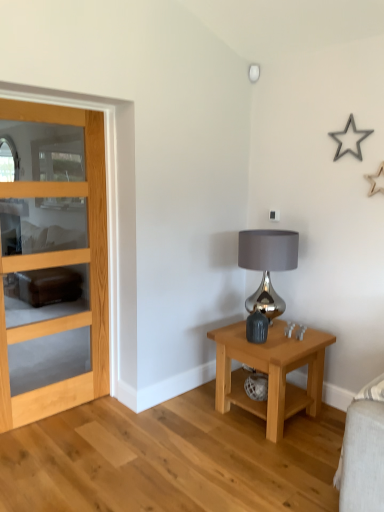
Question: Is light wood/glass door at left smaller than light wood/finish nightstand at lower right?

Choices:
 (A) yes
 (B) no

Answer: (A)

Question: Does light wood/glass door at left touch light wood/finish nightstand at lower right?

Choices:
 (A) no
 (B) yes

Answer: (A)

Question: Can you confirm if light wood/glass door at left is thinner than light wood/finish nightstand at lower right?

Choices:
 (A) no
 (B) yes

Answer: (B)

Question: Considering the relative sizes of light wood/glass door at left and light wood/finish nightstand at lower right in the image provided, is light wood/glass door at left taller than light wood/finish nightstand at lower right?

Choices:
 (A) yes
 (B) no

Answer: (A)

Question: From a real-world perspective, is light wood/glass door at left located beneath light wood/finish nightstand at lower right?

Choices:
 (A) yes
 (B) no

Answer: (B)

Question: From a real-world perspective, relative to light wood/finish nightstand at lower right, is light wood/glass door at left vertically above or below?

Choices:
 (A) above
 (B) below

Answer: (A)

Question: Considering the positions of light wood/glass door at left and light wood/finish nightstand at lower right in the image, is light wood/glass door at left wider or thinner than light wood/finish nightstand at lower right?

Choices:
 (A) wide
 (B) thin

Answer: (B)

Question: Is light wood/glass door at left to the left or to the right of light wood/finish nightstand at lower right in the image?

Choices:
 (A) right
 (B) left

Answer: (B)

Question: Is point (21, 416) closer or farther from the camera than point (269, 385)?

Choices:
 (A) closer
 (B) farther

Answer: (B)

Question: From a real-world perspective, is light wood/finish nightstand at lower right physically located above or below satin silver lamp at upper center?

Choices:
 (A) below
 (B) above

Answer: (A)

Question: Considering their positions, is light wood/finish nightstand at lower right located in front of or behind satin silver lamp at upper center?

Choices:
 (A) front
 (B) behind

Answer: (A)

Question: From the image's perspective, is light wood/finish nightstand at lower right positioned above or below satin silver lamp at upper center?

Choices:
 (A) above
 (B) below

Answer: (B)

Question: Is light wood/finish nightstand at lower right wider or thinner than satin silver lamp at upper center?

Choices:
 (A) wide
 (B) thin

Answer: (A)

Question: Based on their positions, is light wood/finish nightstand at lower right located to the left or right of metallic gray lampshade at right?

Choices:
 (A) left
 (B) right

Answer: (B)

Question: In terms of width, does light wood/finish nightstand at lower right look wider or thinner when compared to metallic gray lampshade at right?

Choices:
 (A) wide
 (B) thin

Answer: (A)